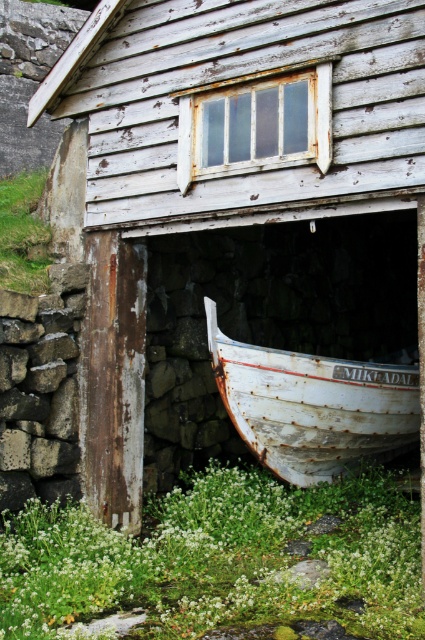
You are standing in front of the rustic wooden structure. There is a point marked at coordinates (x=223, y=561). What object is located at that point?

The point at coordinates (x=223, y=561) indicates the location of the green leafy weed at lower center.

You are standing in front of the rustic wooden structure and notice the green leafy weed at lower center and the rusty white boat at lower center. Which object is closer to the ground?

The green leafy weed at lower center is closer to the ground because it is positioned below the rusty white boat at lower center.